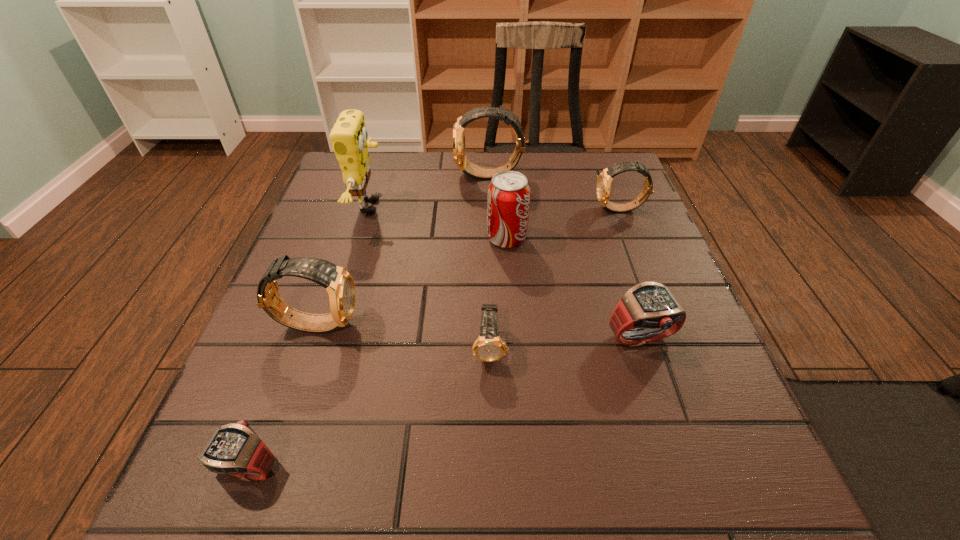
You are a GUI agent. You are given a task and a screenshot of the screen. Output one action in this format:
    pyautogui.click(x=<x>, y=<y>)
    Task: Click on the free space located on the face of the fifth tallest object
    The width and height of the screenshot is (960, 540).
    Given the screenshot: What is the action you would take?
    pyautogui.click(x=458, y=210)

The height and width of the screenshot is (540, 960). What are the coordinates of `free spot located 0.280m on the face of the fifth tallest object` in the screenshot? It's located at (479, 210).

Locate an element on the screen. free space located 0.360m on the left of the right red watch is located at coordinates (402, 339).

I want to click on free space located 0.150m on the face of the smallest gold watch, so click(x=492, y=459).

In order to click on vacant region located on the right of the nearest watch in this screenshot , I will do `click(396, 467)`.

This screenshot has height=540, width=960. I want to click on sponge that is at the far edge, so click(x=349, y=137).

This screenshot has height=540, width=960. Identify the location of watch that is at the far edge. (469, 168).

Locate an element on the screen. object that is at the near edge is located at coordinates (235, 449).

The width and height of the screenshot is (960, 540). Identify the location of sponge at the left edge. (349, 137).

In order to click on object that is at the far left corner in this screenshot , I will do `click(349, 137)`.